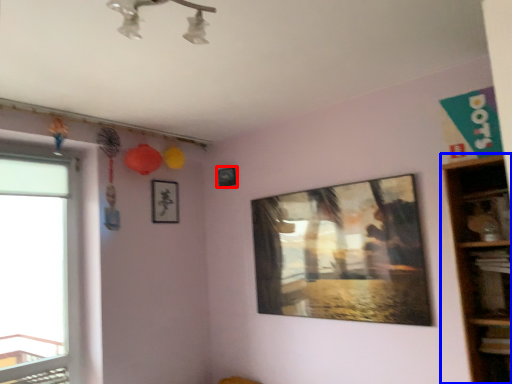
Question: Among these objects, which one is farthest to the camera, picture frame (highlighted by a red box) or shelf (highlighted by a blue box)?

Choices:
 (A) picture frame
 (B) shelf

Answer: (A)